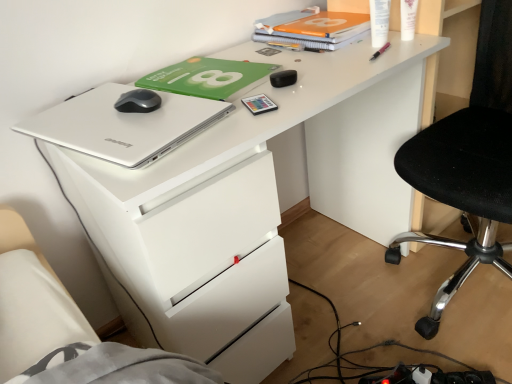
You are a GUI agent. You are given a task and a screenshot of the screen. Output one action in this format:
    pyautogui.click(x=<x>, y=<y>)
    Task: Click on the vacant area situated to the left side of satin black mouse at upper left
    This screenshot has width=512, height=384.
    Given the screenshot: What is the action you would take?
    pyautogui.click(x=79, y=115)